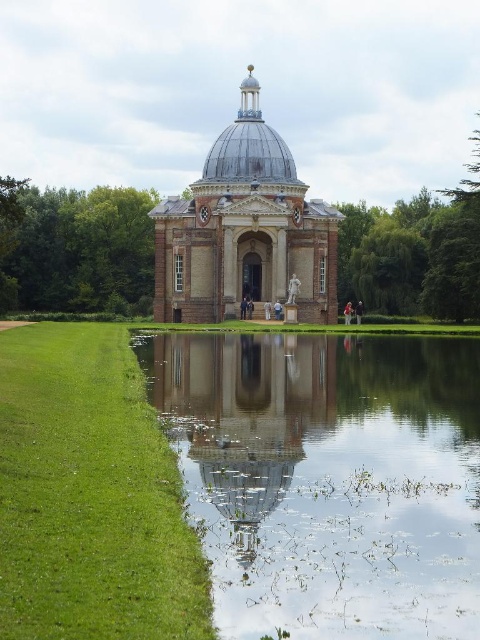
Can you confirm if clear water at center is positioned below metallic silver dome at center?

Correct, clear water at center is located below metallic silver dome at center.

From the picture: Who is more distant from viewer, [283,528] or [265,147]?

The point [265,147] is more distant.

Which is behind, point (403, 525) or point (215, 150)?

The point (215, 150) is behind.

The image size is (480, 640). I want to click on clear water at center, so click(328, 477).

Is clear water at center wider than smooth glass dome at center?

Yes.

Is point (457, 532) farther from camera compared to point (207, 362)?

That is False.

Between point (405, 508) and point (275, 365), which one is positioned behind?

The point (275, 365) is more distant.

I want to click on clear water at center, so click(x=328, y=477).

Is smooth glass dome at center below metallic silver dome at center?

Indeed, smooth glass dome at center is positioned under metallic silver dome at center.

Is smooth glass dome at center to the left of metallic silver dome at center from the viewer's perspective?

Yes, smooth glass dome at center is to the left of metallic silver dome at center.

This screenshot has width=480, height=640. What are the coordinates of `smooth glass dome at center` in the screenshot? It's located at (240, 420).

Identify the location of smooth glass dome at center. The height and width of the screenshot is (640, 480). (240, 420).